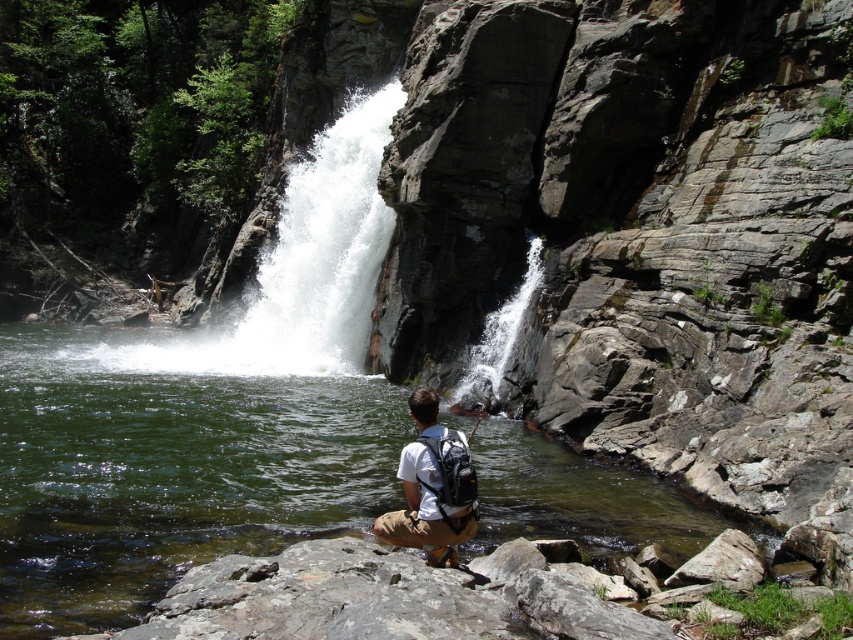
Question: Which point is closer to the camera?

Choices:
 (A) clear water at center
 (B) white matte backpack at center
 (C) white frothy water at center

Answer: (A)

Question: Which point is farther from the camera taking this photo?

Choices:
 (A) (445, 436)
 (B) (285, 257)
 (C) (323, 472)

Answer: (B)

Question: Is clear water at center to the left of white matte backpack at center from the viewer's perspective?

Choices:
 (A) no
 (B) yes

Answer: (B)

Question: Considering the real-world distances, which object is closest to the white matte backpack at center?

Choices:
 (A) clear water at center
 (B) white frothy water at center

Answer: (A)

Question: Where is clear water at center located in relation to white frothy water at center in the image?

Choices:
 (A) right
 (B) left

Answer: (A)

Question: Can you confirm if clear water at center is smaller than white frothy water at center?

Choices:
 (A) yes
 (B) no

Answer: (A)